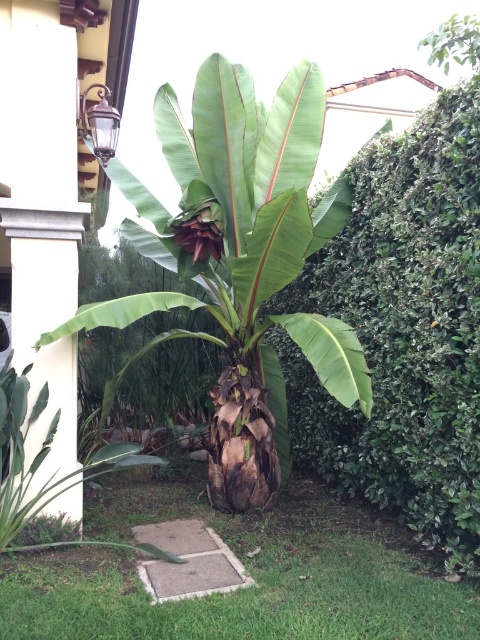
Question: Can you confirm if green leafy bush at center is positioned to the left of green leafy banana tree at center?

Choices:
 (A) no
 (B) yes

Answer: (A)

Question: Can you confirm if green leafy bush at center is bigger than green grass at center?

Choices:
 (A) no
 (B) yes

Answer: (B)

Question: Which object is the closest to the green leafy bush at center?

Choices:
 (A) green grass at center
 (B) green leafy banana tree at center

Answer: (B)

Question: Among these points, which one is nearest to the camera?

Choices:
 (A) (359, 524)
 (B) (204, 138)
 (C) (385, 385)

Answer: (C)

Question: Among these points, which one is farthest from the camera?

Choices:
 (A) pyautogui.click(x=340, y=403)
 (B) pyautogui.click(x=411, y=301)

Answer: (B)

Question: Is green leafy bush at center closer to the viewer compared to green grass at center?

Choices:
 (A) no
 (B) yes

Answer: (A)